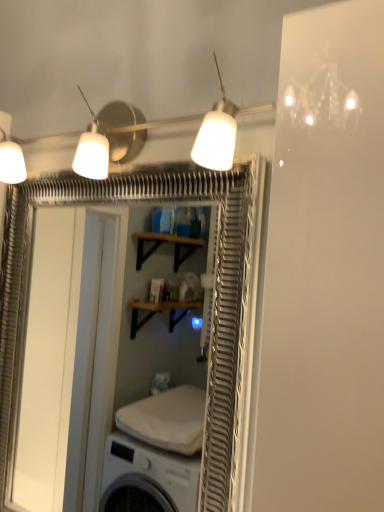
Question: Should I look upward or downward to see white matte lampshade at upper center?

Choices:
 (A) up
 (B) down

Answer: (A)

Question: Is white glossy screen door at upper center taller than white matte lampshade at upper center?

Choices:
 (A) yes
 (B) no

Answer: (A)

Question: From a real-world perspective, is white glossy screen door at upper center located higher than white matte lampshade at upper center?

Choices:
 (A) no
 (B) yes

Answer: (A)

Question: Is white glossy screen door at upper center placed right next to white matte lampshade at upper center?

Choices:
 (A) no
 (B) yes

Answer: (A)

Question: Is white glossy screen door at upper center smaller than white matte lampshade at upper center?

Choices:
 (A) no
 (B) yes

Answer: (A)

Question: Is white glossy screen door at upper center bigger than white matte lampshade at upper center?

Choices:
 (A) yes
 (B) no

Answer: (A)

Question: Is white glossy screen door at upper center closer to camera compared to white matte lampshade at upper center?

Choices:
 (A) yes
 (B) no

Answer: (B)

Question: From the image's perspective, is white matte lampshade at upper center above white glossy screen door at upper center?

Choices:
 (A) yes
 (B) no

Answer: (A)

Question: Is white matte lampshade at upper center in front of white glossy screen door at upper center?

Choices:
 (A) no
 (B) yes

Answer: (B)

Question: Does white matte lampshade at upper center lie behind white glossy screen door at upper center?

Choices:
 (A) no
 (B) yes

Answer: (A)

Question: Considering the relative sizes of white matte lampshade at upper center and white glossy screen door at upper center in the image provided, is white matte lampshade at upper center thinner than white glossy screen door at upper center?

Choices:
 (A) yes
 (B) no

Answer: (B)

Question: Can you confirm if white matte lampshade at upper center is bigger than white glossy screen door at upper center?

Choices:
 (A) yes
 (B) no

Answer: (B)

Question: Does white matte lampshade at upper center have a lesser height compared to white glossy screen door at upper center?

Choices:
 (A) yes
 (B) no

Answer: (A)

Question: In terms of size, does white matte lampshade at upper center appear bigger or smaller than white glossy screen door at upper center?

Choices:
 (A) big
 (B) small

Answer: (B)